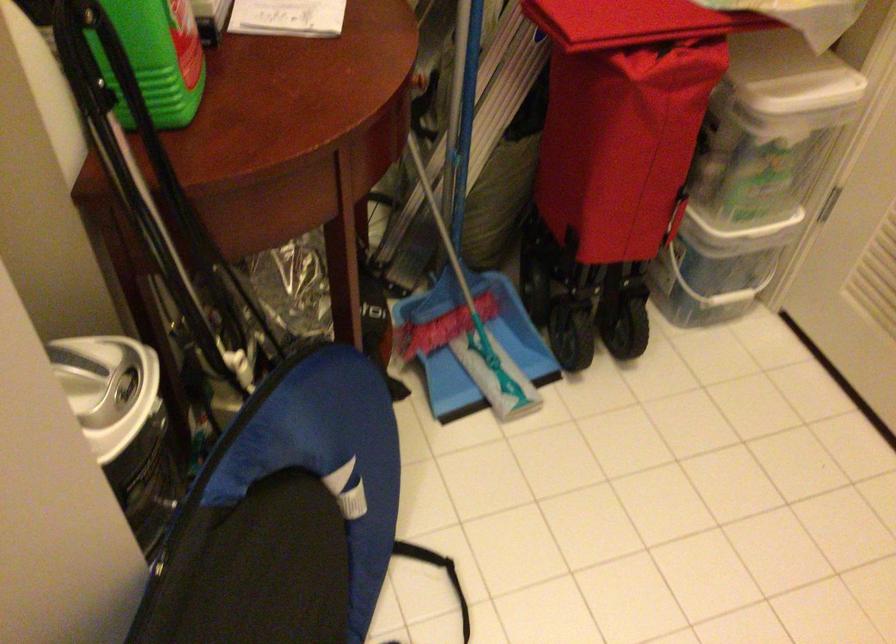
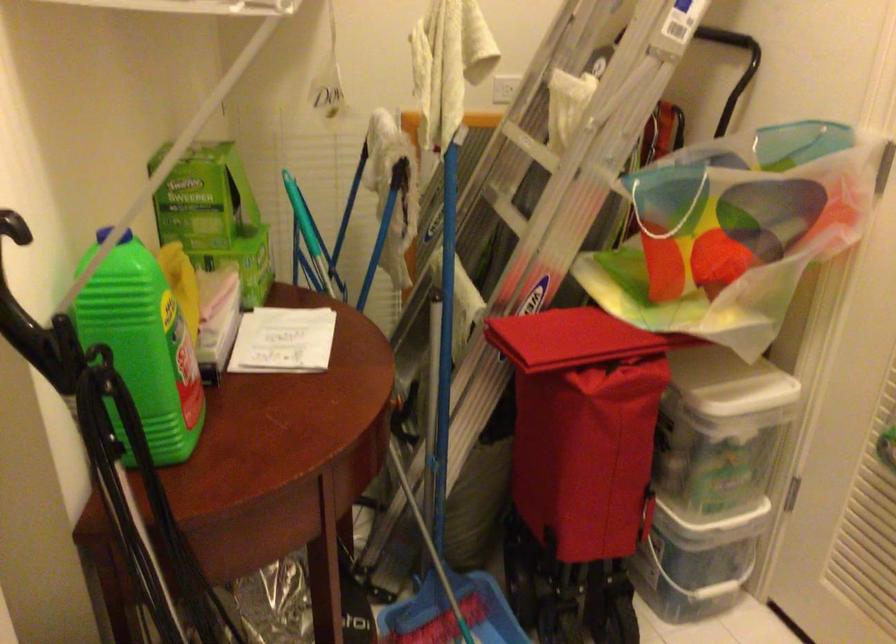
Question: What movement of the cameraman would produce the second image?

Choices:
 (A) Left
 (B) Right
 (C) Forward
 (D) Backward

Answer: (D)